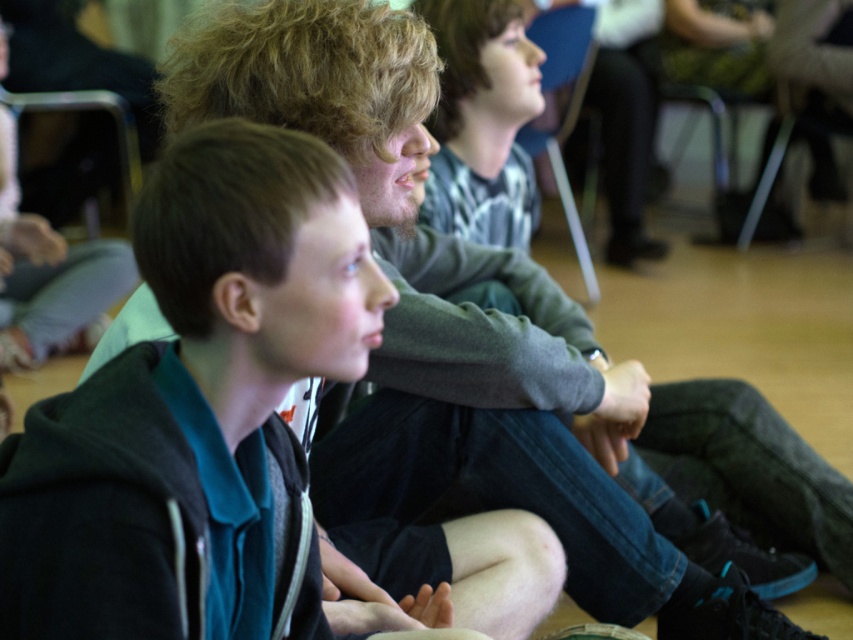
Question: Among these objects, which one is farthest from the camera?

Choices:
 (A) metallic black chair at upper left
 (B) blue fabric chair at upper center
 (C) black matte hoodie at left

Answer: (A)

Question: Which of the following is the closest to the observer?

Choices:
 (A) metallic black chair at upper left
 (B) black matte hoodie at left

Answer: (B)

Question: Is black matte hoodie at left above blue fabric chair at upper center?

Choices:
 (A) no
 (B) yes

Answer: (A)

Question: Does blue fabric chair at upper center come behind metallic black chair at upper left?

Choices:
 (A) no
 (B) yes

Answer: (A)

Question: Does blue fabric chair at upper center have a lesser width compared to metallic black chair at upper left?

Choices:
 (A) yes
 (B) no

Answer: (A)

Question: Among these points, which one is nearest to the camera?

Choices:
 (A) (134, 620)
 (B) (126, 198)

Answer: (A)